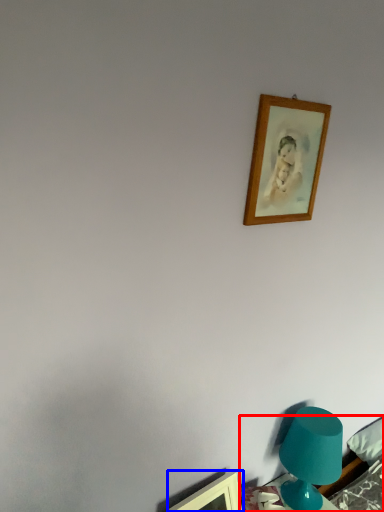
Question: Which object is closer to the camera taking this photo, furniture (highlighted by a red box) or picture frame (highlighted by a blue box)?

Choices:
 (A) furniture
 (B) picture frame

Answer: (B)